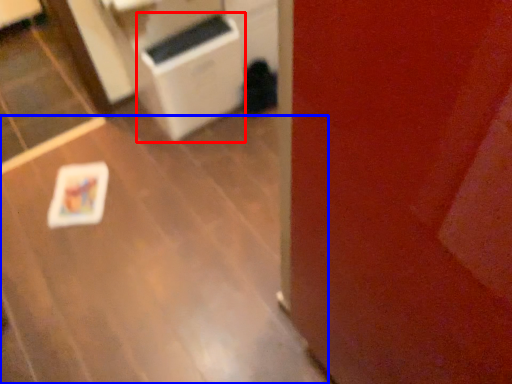
Question: Which object is closer to the camera taking this photo, appliance (highlighted by a red box) or table (highlighted by a blue box)?

Choices:
 (A) appliance
 (B) table

Answer: (B)